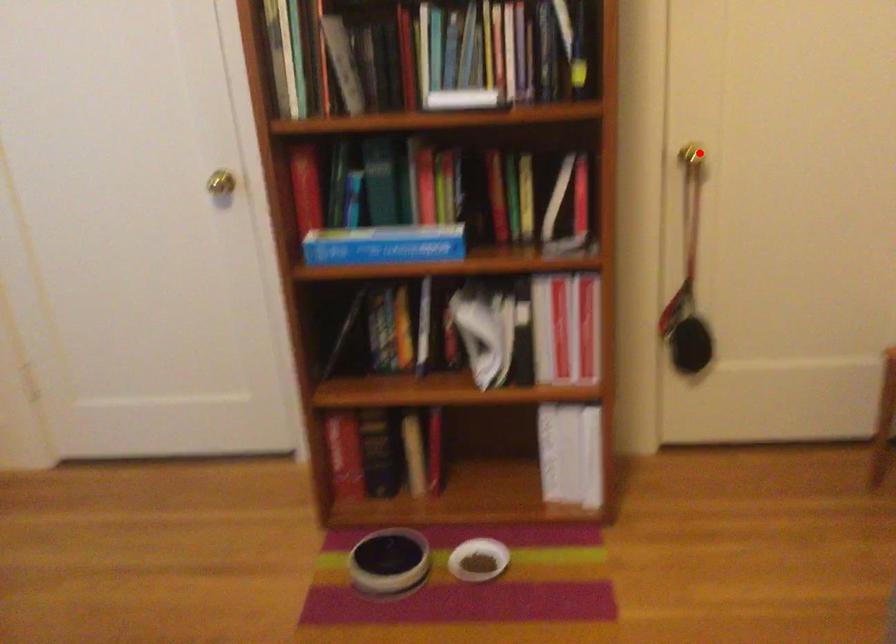
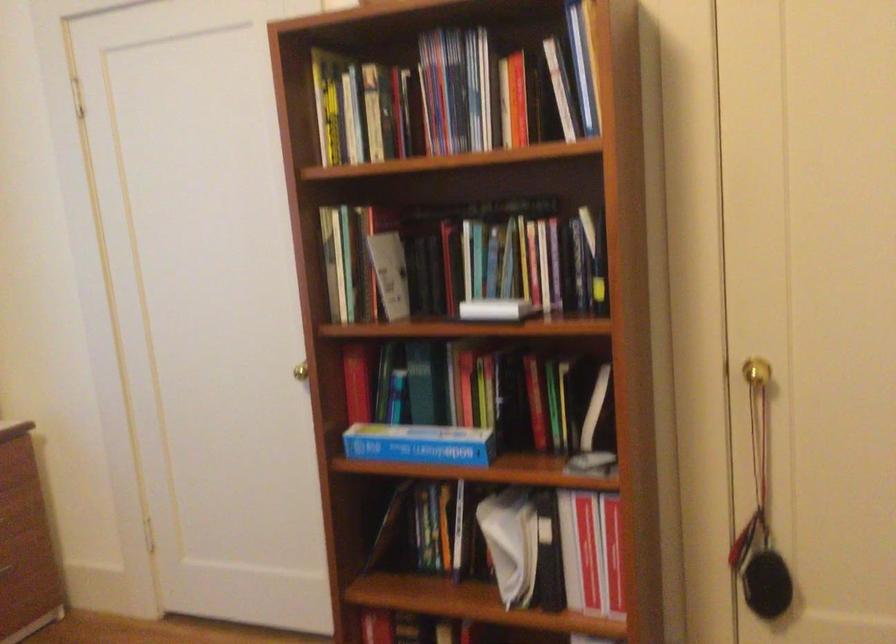
Find the pixel in the second image that matches the highlighted location in the first image.

(755, 372)